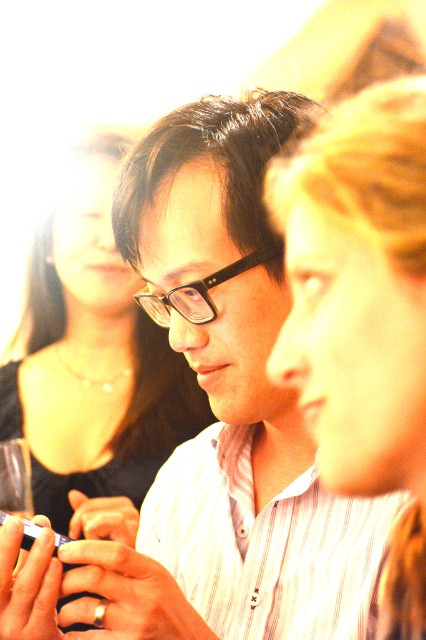
Question: Does black glossy hair at upper left appear on the right side of black plastic glasses at center?

Choices:
 (A) yes
 (B) no

Answer: (B)

Question: From the image, what is the correct spatial relationship of black glossy hair at upper left in relation to black plastic glasses at center?

Choices:
 (A) right
 (B) left

Answer: (B)

Question: Which object is farther from the camera taking this photo?

Choices:
 (A) black glossy hair at upper left
 (B) black plastic glasses at center

Answer: (A)

Question: Does black glossy hair at upper left appear on the left side of black plastic glasses at center?

Choices:
 (A) yes
 (B) no

Answer: (A)

Question: Which object is closer to the camera taking this photo?

Choices:
 (A) black plastic glasses at center
 (B) black glossy hair at upper left

Answer: (A)